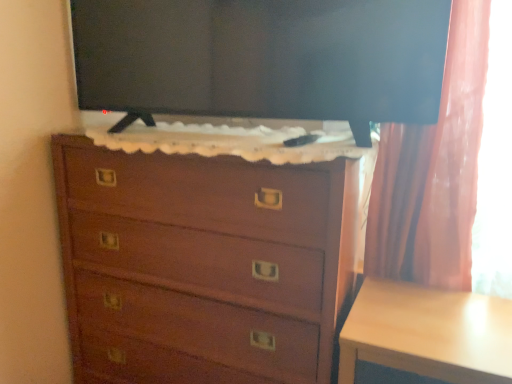
Question: From a real-world perspective, is black glossy tv at upper center below wooden chest of drawers at center?

Choices:
 (A) yes
 (B) no

Answer: (B)

Question: Does black glossy tv at upper center have a smaller size compared to wooden chest of drawers at center?

Choices:
 (A) no
 (B) yes

Answer: (B)

Question: Are black glossy tv at upper center and wooden chest of drawers at center far apart?

Choices:
 (A) no
 (B) yes

Answer: (A)

Question: Is black glossy tv at upper center positioned beyond the bounds of wooden chest of drawers at center?

Choices:
 (A) yes
 (B) no

Answer: (A)

Question: Does black glossy tv at upper center appear on the right side of wooden chest of drawers at center?

Choices:
 (A) yes
 (B) no

Answer: (A)

Question: Is black glossy tv at upper center looking in the opposite direction of wooden chest of drawers at center?

Choices:
 (A) no
 (B) yes

Answer: (A)

Question: Considering the relative sizes of black glossy tv at upper center and light wood table at lower right in the image provided, is black glossy tv at upper center thinner than light wood table at lower right?

Choices:
 (A) no
 (B) yes

Answer: (B)

Question: Is black glossy tv at upper center taller than light wood table at lower right?

Choices:
 (A) yes
 (B) no

Answer: (B)

Question: Is black glossy tv at upper center positioned with its back to light wood table at lower right?

Choices:
 (A) yes
 (B) no

Answer: (B)

Question: Is black glossy tv at upper center shorter than light wood table at lower right?

Choices:
 (A) yes
 (B) no

Answer: (A)

Question: From the image's perspective, would you say black glossy tv at upper center is shown under light wood table at lower right?

Choices:
 (A) yes
 (B) no

Answer: (B)

Question: Considering the relative positions of black glossy tv at upper center and light wood table at lower right in the image provided, is black glossy tv at upper center to the left of light wood table at lower right from the viewer's perspective?

Choices:
 (A) no
 (B) yes

Answer: (B)

Question: Could you tell me if light wood table at lower right is turned towards black glossy tv at upper center?

Choices:
 (A) no
 (B) yes

Answer: (A)